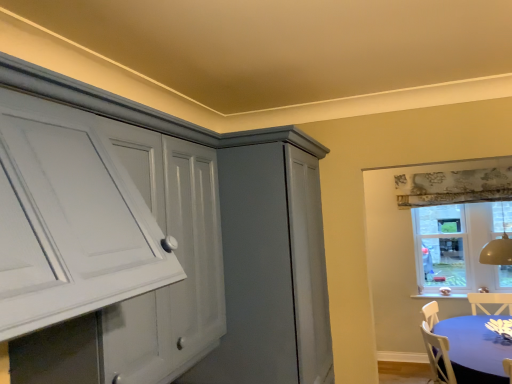
Question: From the image's perspective, is clear glass window at upper right positioned above or below blue fabric table at lower right?

Choices:
 (A) above
 (B) below

Answer: (A)

Question: Considering the positions of point (457, 210) and point (464, 319), is point (457, 210) closer or farther from the camera than point (464, 319)?

Choices:
 (A) closer
 (B) farther

Answer: (B)

Question: Considering the positions of clear glass window at upper right and blue fabric table at lower right in the image, is clear glass window at upper right bigger or smaller than blue fabric table at lower right?

Choices:
 (A) small
 (B) big

Answer: (A)

Question: Looking at their shapes, would you say blue fabric table at lower right is wider or thinner than clear glass window at upper right?

Choices:
 (A) thin
 (B) wide

Answer: (B)

Question: Is blue fabric table at lower right to the left or to the right of clear glass window at upper right in the image?

Choices:
 (A) left
 (B) right

Answer: (A)

Question: Choose the correct answer: Is blue fabric table at lower right inside clear glass window at upper right or outside it?

Choices:
 (A) outside
 (B) inside

Answer: (A)

Question: From their relative heights in the image, would you say blue fabric table at lower right is taller or shorter than clear glass window at upper right?

Choices:
 (A) short
 (B) tall

Answer: (A)